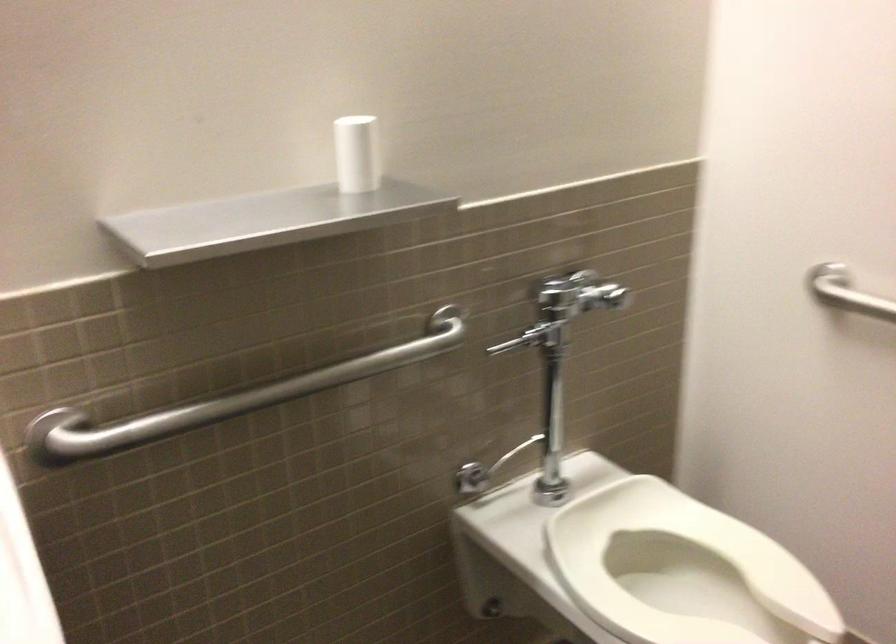
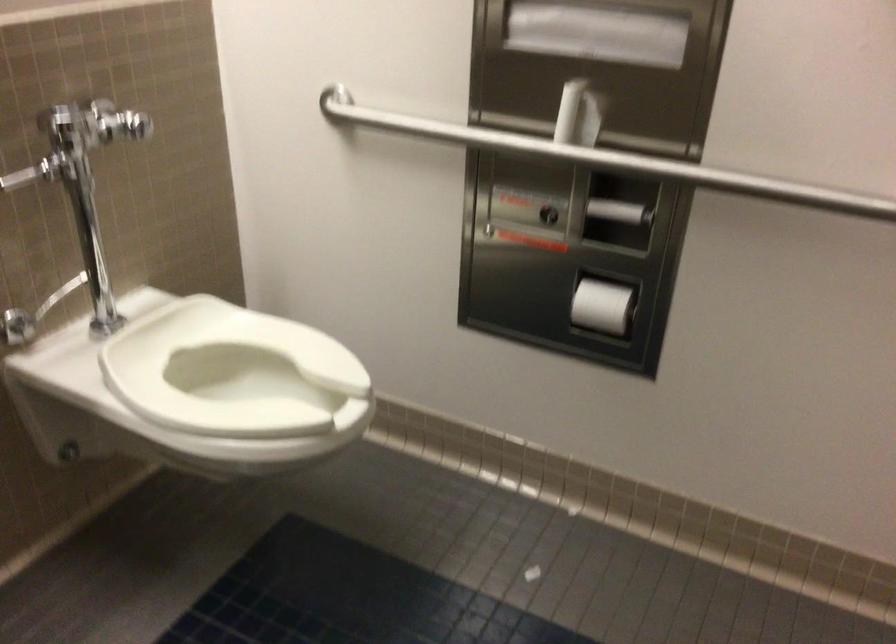
Question: The camera is either moving clockwise (left) or counter-clockwise (right) around the object. The first image is from the beginning of the video and the second image is from the end. Is the camera moving left or right when shooting the video?

Choices:
 (A) Left
 (B) Right

Answer: (A)